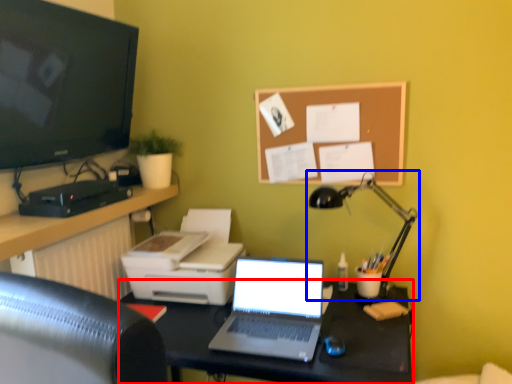
Question: Which object appears farthest to the camera in this image, desk (highlighted by a red box) or lamp (highlighted by a blue box)?

Choices:
 (A) desk
 (B) lamp

Answer: (B)